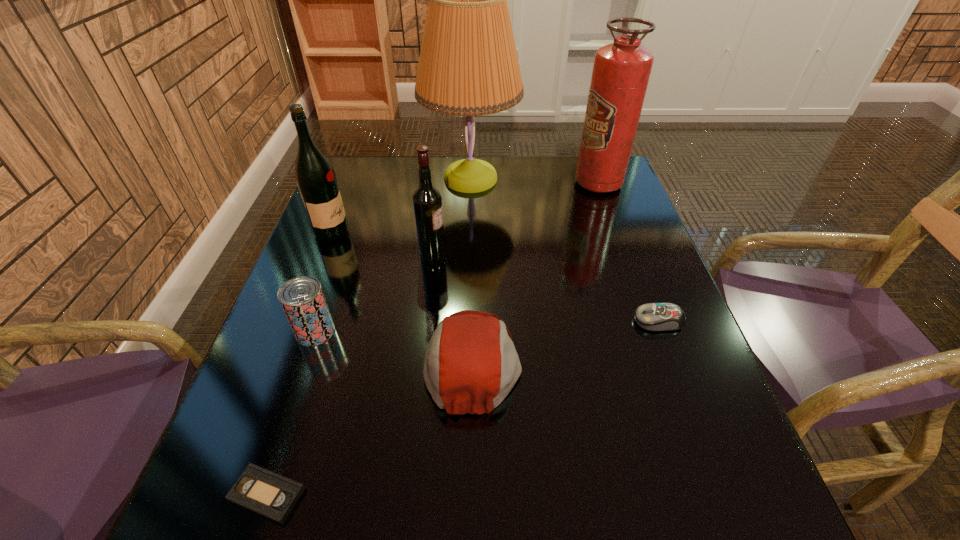
The height and width of the screenshot is (540, 960). I want to click on vacant space that satisfies the following two spatial constraints: 1. on the front-facing side of the cap; 2. on the front side of the nearest object, so click(471, 494).